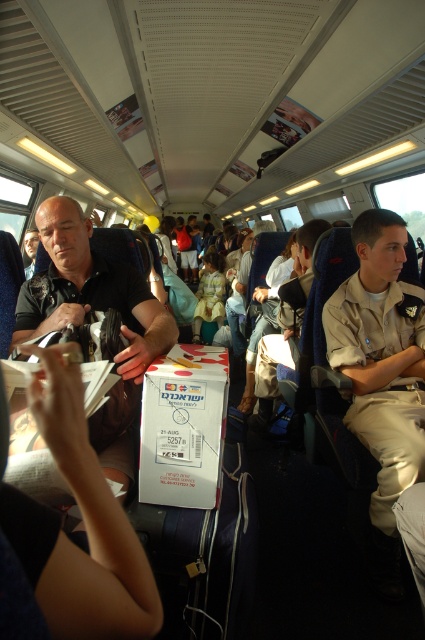
Is khaki uniform at right taller than matte black shirt at left?

Correct, khaki uniform at right is much taller as matte black shirt at left.

Is khaki uniform at right to the left of matte black shirt at left from the viewer's perspective?

In fact, khaki uniform at right is to the right of matte black shirt at left.

At what (x,y) coordinates should I click in order to perform the action: click on khaki uniform at right. Please return your answer as a coordinate pair (x, y). This screenshot has width=425, height=640. Looking at the image, I should click on (382, 356).